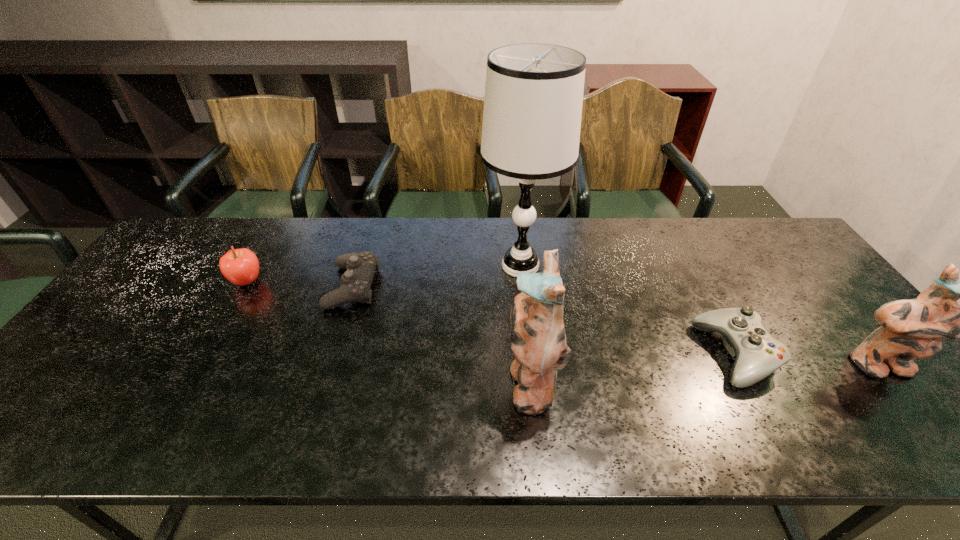
In order to click on the right control in this screenshot , I will do `click(758, 354)`.

Identify the location of vacant position located 0.200m on the front-facing side of the taller figurine. Image resolution: width=960 pixels, height=540 pixels. [x=420, y=382].

Where is `blank area located 0.280m on the front-facing side of the taller figurine`? This screenshot has width=960, height=540. blank area located 0.280m on the front-facing side of the taller figurine is located at coordinates (387, 382).

This screenshot has height=540, width=960. In order to click on vacant position located 0.140m on the front-facing side of the taller figurine in this screenshot , I will do `click(446, 382)`.

I want to click on free spot located 0.060m on the front-facing side of the shorter figurine, so (911, 406).

Locate an element on the screen. The image size is (960, 540). vacant point located 0.220m on the front of the tallest object is located at coordinates (530, 356).

This screenshot has width=960, height=540. I want to click on free space located on the back of the farther control, so click(x=369, y=239).

Where is `vacant space positioned on the right of the apple`? The height and width of the screenshot is (540, 960). vacant space positioned on the right of the apple is located at coordinates (319, 281).

Where is `free point located on the back of the nearer control`? free point located on the back of the nearer control is located at coordinates (709, 306).

The image size is (960, 540). What are the coordinates of `table lamp situated at the far edge` in the screenshot? It's located at (533, 100).